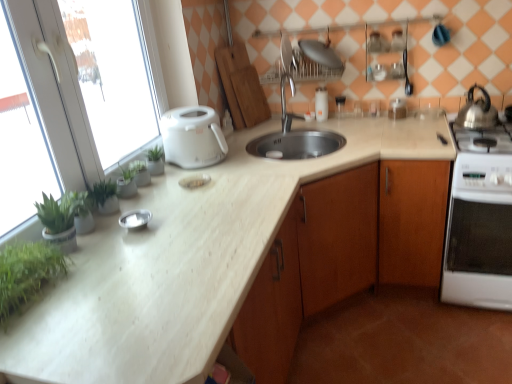
Locate an element on the screen. vacant space that is to the left of white glossy salt shaker at upper center, the second appliance in the top-to-bottom sequence is located at coordinates (293, 118).